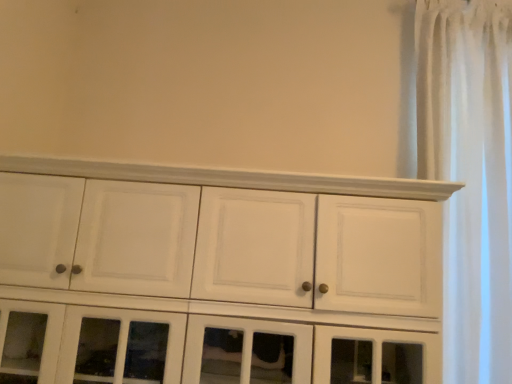
Question: Considering the positions of point 436,289 and point 442,38, is point 436,289 closer or farther from the camera than point 442,38?

Choices:
 (A) closer
 (B) farther

Answer: (A)

Question: From their relative heights in the image, would you say white painted wood cupboard at center is taller or shorter than white sheer curtain at right?

Choices:
 (A) tall
 (B) short

Answer: (B)

Question: From the image's perspective, relative to white sheer curtain at right, is white painted wood cupboard at center above or below?

Choices:
 (A) above
 (B) below

Answer: (B)

Question: Looking at their shapes, would you say white sheer curtain at right is wider or thinner than white painted wood cupboard at center?

Choices:
 (A) wide
 (B) thin

Answer: (B)

Question: From a real-world perspective, is white sheer curtain at right positioned above or below white painted wood cupboard at center?

Choices:
 (A) below
 (B) above

Answer: (B)

Question: Considering their positions, is white sheer curtain at right located in front of or behind white painted wood cupboard at center?

Choices:
 (A) behind
 (B) front

Answer: (A)

Question: Is point (456, 72) positioned closer to the camera than point (415, 195)?

Choices:
 (A) farther
 (B) closer

Answer: (A)